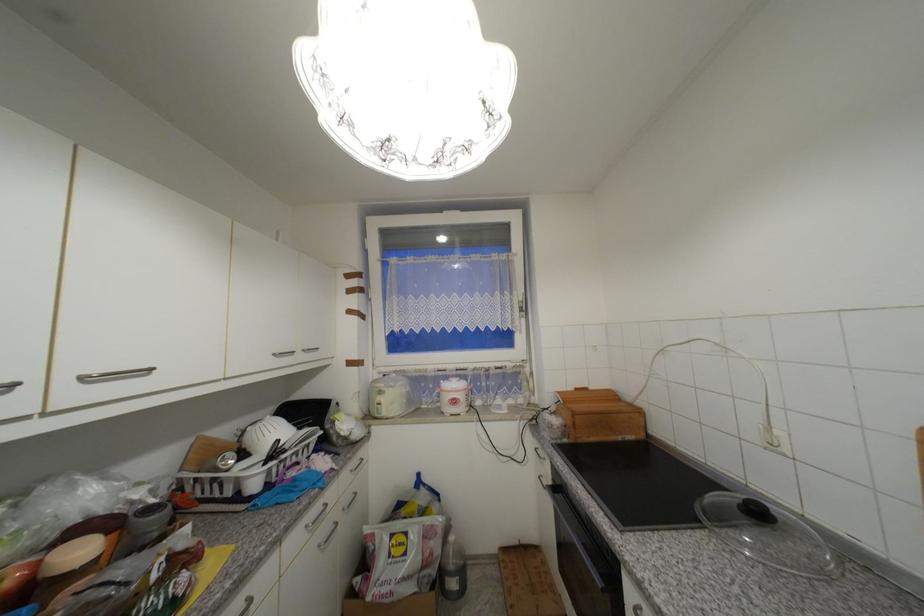
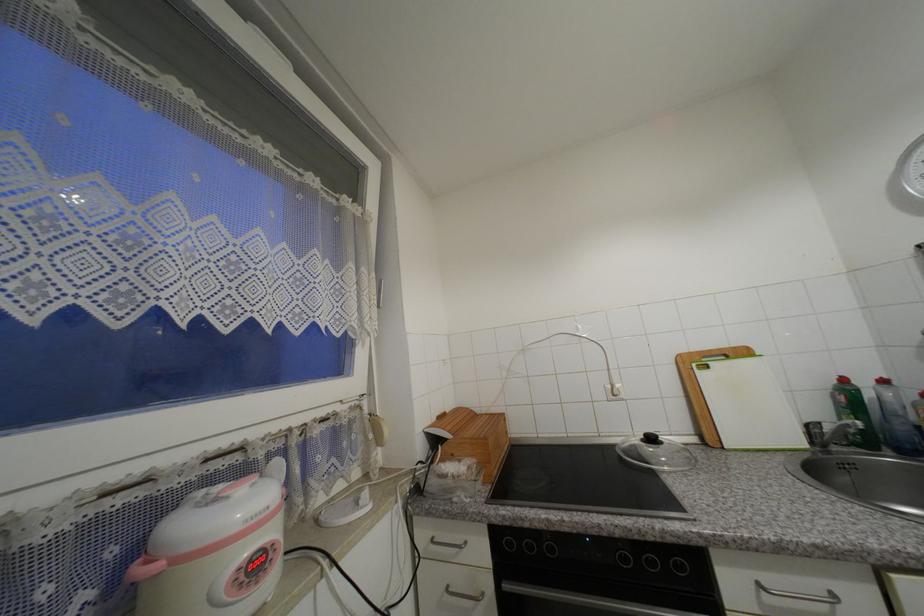
Locate, in the second image, the point that corresponds to (576,390) in the first image.

(440, 419)